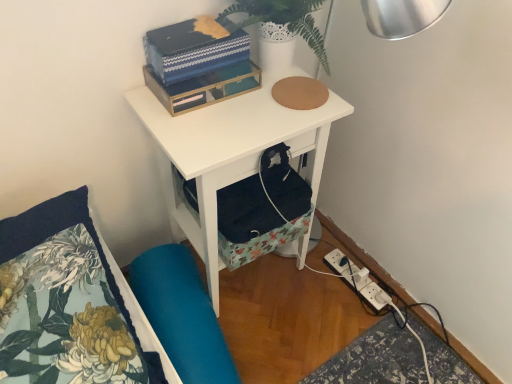
Question: From the image's perspective, does blue textured box at upper center appear higher than floral fabric pillow at lower left?

Choices:
 (A) no
 (B) yes

Answer: (B)

Question: Does blue textured box at upper center appear on the left side of floral fabric pillow at lower left?

Choices:
 (A) yes
 (B) no

Answer: (B)

Question: Is blue textured box at upper center smaller than floral fabric pillow at lower left?

Choices:
 (A) yes
 (B) no

Answer: (A)

Question: Would you say blue textured box at upper center contains floral fabric pillow at lower left?

Choices:
 (A) yes
 (B) no

Answer: (B)

Question: From a real-world perspective, does blue textured box at upper center sit lower than floral fabric pillow at lower left?

Choices:
 (A) yes
 (B) no

Answer: (B)

Question: Does blue textured box at upper center have a lesser width compared to floral fabric pillow at lower left?

Choices:
 (A) no
 (B) yes

Answer: (B)

Question: From a real-world perspective, is white textured vase at upper center over blue textured box at upper center?

Choices:
 (A) yes
 (B) no

Answer: (A)

Question: Is white textured vase at upper center smaller than blue textured box at upper center?

Choices:
 (A) no
 (B) yes

Answer: (A)

Question: Is blue textured box at upper center at the back of white textured vase at upper center?

Choices:
 (A) yes
 (B) no

Answer: (B)

Question: Is white textured vase at upper center located outside blue textured box at upper center?

Choices:
 (A) yes
 (B) no

Answer: (A)

Question: Does white textured vase at upper center have a lesser width compared to blue textured box at upper center?

Choices:
 (A) yes
 (B) no

Answer: (B)

Question: From the image's perspective, does white textured vase at upper center appear lower than blue textured box at upper center?

Choices:
 (A) yes
 (B) no

Answer: (B)

Question: Is floral fabric pillow at lower left outside of blue textured box at upper center?

Choices:
 (A) yes
 (B) no

Answer: (A)